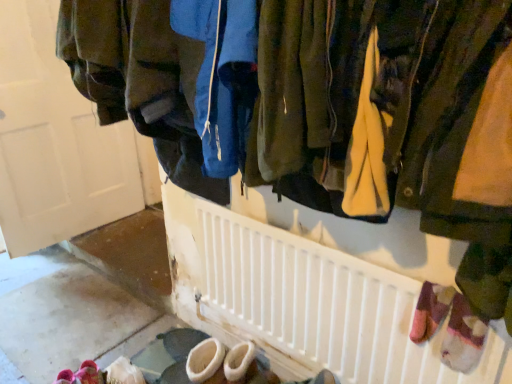
Identify the location of white plastic radiator at center. This screenshot has height=384, width=512. (315, 288).

Measure the distance between point (82, 367) and camera.

Point (82, 367) and camera are 1.83 meters apart from each other.

Where is `matte white door at upper left`? matte white door at upper left is located at coordinates (54, 141).

How distant is matte white door at upper left from white plastic radiator at center?

matte white door at upper left is 1.44 meters away from white plastic radiator at center.

Identify the location of radiator lying on the right of matte white door at upper left. The width and height of the screenshot is (512, 384). (315, 288).

Based on the photo, in terms of width, does matte white door at upper left look wider or thinner when compared to white plastic radiator at center?

Clearly, matte white door at upper left has more width compared to white plastic radiator at center.

From the image's perspective, is matte white door at upper left above or below white plastic radiator at center?

matte white door at upper left is above white plastic radiator at center.

Is matte white door at upper left positioned with its back to pink fuzzy slippers at lower left?

No, pink fuzzy slippers at lower left is not at the back of matte white door at upper left.

Which object is positioned more to the left, matte white door at upper left or pink fuzzy slippers at lower left?

From the viewer's perspective, matte white door at upper left appears more on the left side.

Between point (41, 78) and point (77, 371), which one is positioned in front?

The point (77, 371) is closer to the camera.

Is pink fuzzy slippers at lower left taller than matte white door at upper left?

No, pink fuzzy slippers at lower left is not taller than matte white door at upper left.

How different are the orientations of pink fuzzy slippers at lower left and matte white door at upper left in degrees?

There is a 32.3-degree angle between the facing directions of pink fuzzy slippers at lower left and matte white door at upper left.

Considering the relative sizes of pink fuzzy slippers at lower left and matte white door at upper left in the image provided, is pink fuzzy slippers at lower left smaller than matte white door at upper left?

Indeed, pink fuzzy slippers at lower left has a smaller size compared to matte white door at upper left.

Identify the location of door behind the white plastic radiator at center. (54, 141).

Looking at this image, how different are the orientations of white plastic radiator at center and matte white door at upper left in degrees?

88.9 degrees.

Is white plastic radiator at center wider or thinner than matte white door at upper left?

In the image, white plastic radiator at center appears to be more narrow than matte white door at upper left.

From the picture: Which is closer to the camera, [364,334] or [53,51]?

The point [364,334] is more forward.

From the image's perspective, is pink fuzzy slippers at lower left under white plastic radiator at center?

Correct, pink fuzzy slippers at lower left appears lower than white plastic radiator at center in the image.

From a real-world perspective, who is located higher, pink fuzzy slippers at lower left or white plastic radiator at center?

In real-world perspective, white plastic radiator at center is above.

Considering the positions of objects pink fuzzy slippers at lower left and white plastic radiator at center in the image provided, who is more to the left, pink fuzzy slippers at lower left or white plastic radiator at center?

pink fuzzy slippers at lower left.

Looking at this image, can you tell me how much pink fuzzy slippers at lower left and white plastic radiator at center differ in facing direction?

56.7 degrees separate the facing orientations of pink fuzzy slippers at lower left and white plastic radiator at center.

Is white plastic radiator at center closer to camera compared to pink fuzzy slippers at lower left?

Yes, it is.

Considering the relative positions of white plastic radiator at center and pink fuzzy slippers at lower left in the image provided, is white plastic radiator at center to the right of pink fuzzy slippers at lower left from the viewer's perspective?

Yes, white plastic radiator at center is to the right of pink fuzzy slippers at lower left.

From a real-world perspective, is white plastic radiator at center on pink fuzzy slippers at lower left?

Yes, from a real-world perspective, white plastic radiator at center is on top of pink fuzzy slippers at lower left.

Does white plastic radiator at center contain pink fuzzy slippers at lower left?

No, pink fuzzy slippers at lower left is not inside white plastic radiator at center.

You are a GUI agent. You are given a task and a screenshot of the screen. Output one action in this format:
    pyautogui.click(x=<x>, y=<y>)
    Task: Click on the radiator on the right of matte white door at upper left
    This screenshot has width=512, height=384.
    Given the screenshot: What is the action you would take?
    pyautogui.click(x=315, y=288)

Locate an element on the screen. door that is above the pink fuzzy slippers at lower left (from a real-world perspective) is located at coordinates (54, 141).

Estimate the real-world distances between objects in this image. Which object is closer to pink fuzzy slippers at lower left, white plastic radiator at center or matte white door at upper left?

white plastic radiator at center.

Which object lies further to the anchor point matte white door at upper left, pink fuzzy slippers at lower left or white plastic radiator at center?

white plastic radiator at center lies further to matte white door at upper left than the other object.

When comparing their distances from matte white door at upper left, does white plastic radiator at center or pink fuzzy slippers at lower left seem closer?

pink fuzzy slippers at lower left lies closer to matte white door at upper left than the other object.

When comparing their distances from pink fuzzy slippers at lower left, does matte white door at upper left or white plastic radiator at center seem further?

Based on the image, matte white door at upper left appears to be further to pink fuzzy slippers at lower left.

Considering their positions, is pink fuzzy slippers at lower left positioned further to white plastic radiator at center than matte white door at upper left?

matte white door at upper left.

From the image, which object appears to be nearer to white plastic radiator at center, matte white door at upper left or pink fuzzy slippers at lower left?

Among the two, pink fuzzy slippers at lower left is located nearer to white plastic radiator at center.

The image size is (512, 384). Find the location of `footwear between matte white door at upper left and white plastic radiator at center from left to right`. footwear between matte white door at upper left and white plastic radiator at center from left to right is located at coordinates (88, 373).